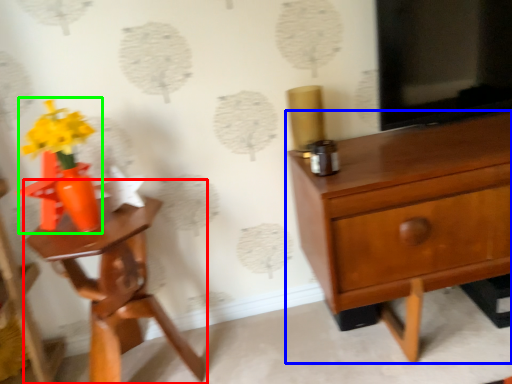
Question: Based on their relative distances, which object is nearer to nightstand (highlighted by a red box)? Choose from chest of drawers (highlighted by a blue box) and floral arrangement (highlighted by a green box).

Choices:
 (A) chest of drawers
 (B) floral arrangement

Answer: (B)